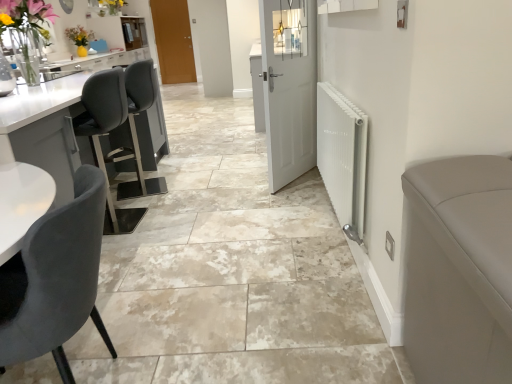
Describe the element at coordinates (58, 71) in the screenshot. I see `white glossy sink at upper left` at that location.

What do you see at coordinates (343, 157) in the screenshot? I see `white metallic radiator at right` at bounding box center [343, 157].

Find the location of a particular element. white matte door at center, the 1th door viewed from the front is located at coordinates (289, 87).

This screenshot has height=384, width=512. What do you see at coordinates (289, 87) in the screenshot?
I see `white matte door at center, marked as the 1th door in a right-to-left arrangement` at bounding box center [289, 87].

What do you see at coordinates (173, 41) in the screenshot? I see `brown wooden door at upper center, marked as the first door in a back-to-front arrangement` at bounding box center [173, 41].

Where is `white glossy sink at upper left`? This screenshot has width=512, height=384. white glossy sink at upper left is located at coordinates (58, 71).

From a real-world perspective, is white metallic radiator at right positioned under white matte door at center, marked as the 1th door in a right-to-left arrangement, based on gravity?

Yes, from a real-world perspective, white metallic radiator at right is under white matte door at center, marked as the 1th door in a right-to-left arrangement.

How distant is white metallic radiator at right from white matte door at center, which is the 2th door in back-to-front order?

The distance of white metallic radiator at right from white matte door at center, which is the 2th door in back-to-front order, is 30.82 inches.

Is white metallic radiator at right oriented away from white matte door at center, the 1th door from the bottom?

No, white matte door at center, the 1th door from the bottom, is not at the back of white metallic radiator at right.

In the scene shown: Is white metallic radiator at right next to white matte door at center, the 1th door viewed from the front, and touching it?

No, white metallic radiator at right is not in contact with white matte door at center, the 1th door viewed from the front.

You are a GUI agent. You are given a task and a screenshot of the screen. Output one action in this format:
    pyautogui.click(x=<x>, y=<y>)
    Task: Click on the door below the brown wooden door at upper center, which appears as the 2th door when ordered from the bottom (from the image's perspective)
    The height and width of the screenshot is (384, 512).
    Given the screenshot: What is the action you would take?
    pyautogui.click(x=289, y=87)

From the picture: Can you confirm if brown wooden door at upper center, marked as the first door in a back-to-front arrangement, is positioned to the left of white matte door at center, the 1th door from the bottom?

Correct, you'll find brown wooden door at upper center, marked as the first door in a back-to-front arrangement, to the left of white matte door at center, the 1th door from the bottom.

Looking at this image, considering the sizes of objects brown wooden door at upper center, which appears as the 2th door when ordered from the bottom, and white matte door at center, the 1th door from the bottom, in the image provided, who is taller, brown wooden door at upper center, which appears as the 2th door when ordered from the bottom, or white matte door at center, the 1th door from the bottom,?

With more height is brown wooden door at upper center, which appears as the 2th door when ordered from the bottom.

Is brown wooden door at upper center, arranged as the 2th door when viewed from the front, not inside white matte door at center, marked as the 1th door in a right-to-left arrangement?

Yes.

Based on the photo, which of these two, brown wooden door at upper center, which is the 1th door from top to bottom, or white glossy sink at upper left, is thinner?

Thinner between the two is brown wooden door at upper center, which is the 1th door from top to bottom.

Is brown wooden door at upper center, arranged as the 1th door when viewed from the left, taller than white glossy sink at upper left?

Yes, brown wooden door at upper center, arranged as the 1th door when viewed from the left, is taller than white glossy sink at upper left.

Considering the points (159, 59) and (61, 68), which point is behind, point (159, 59) or point (61, 68)?

The point (159, 59) is more distant.

Where is `sink on the left side of brown wooden door at upper center, which is the 1th door from top to bottom`? The height and width of the screenshot is (384, 512). sink on the left side of brown wooden door at upper center, which is the 1th door from top to bottom is located at coordinates (58, 71).

Between velvet grey chair at lower left and white glossy sink at upper left, which one appears on the left side from the viewer's perspective?

white glossy sink at upper left is more to the left.

Is there a large distance between velvet grey chair at lower left and white glossy sink at upper left?

Yes, velvet grey chair at lower left and white glossy sink at upper left are quite far apart.

Does velvet grey chair at lower left have a lesser height compared to white glossy sink at upper left?

No.

From the image's perspective, between velvet grey chair at lower left and white glossy sink at upper left, which one is located above?

white glossy sink at upper left, from the image's perspective.

From a real-world perspective, does white glossy sink at upper left sit lower than white metallic radiator at right?

Incorrect, from a real-world perspective, white glossy sink at upper left is higher than white metallic radiator at right.

At what (x,y) coordinates should I click in order to perform the action: click on radiator on the right side of white glossy sink at upper left. Please return your answer as a coordinate pair (x, y). The image size is (512, 384). Looking at the image, I should click on (343, 157).

Are white glossy sink at upper left and white metallic radiator at right located far from each other?

Yes.

From the picture: Does white glossy sink at upper left have a smaller size compared to white metallic radiator at right?

→ Correct, white glossy sink at upper left occupies less space than white metallic radiator at right.

Considering the relative positions of white matte door at center, marked as the 1th door in a right-to-left arrangement, and brown wooden door at upper center, which is the 1th door from top to bottom, in the image provided, is white matte door at center, marked as the 1th door in a right-to-left arrangement, in front of brown wooden door at upper center, which is the 1th door from top to bottom,?

That is True.

Is white matte door at center, which is the 2th door in back-to-front order, bigger or smaller than brown wooden door at upper center, positioned as the 2th door in right-to-left order?

white matte door at center, which is the 2th door in back-to-front order, is bigger than brown wooden door at upper center, positioned as the 2th door in right-to-left order.

Can you confirm if white matte door at center, marked as the 1th door in a right-to-left arrangement, is taller than brown wooden door at upper center, arranged as the 2th door when viewed from the front?

No.

Is brown wooden door at upper center, which appears as the 2th door when ordered from the bottom, touching velvet grey chair at lower left?

brown wooden door at upper center, which appears as the 2th door when ordered from the bottom, and velvet grey chair at lower left are not in contact.

Considering the positions of point (158, 3) and point (27, 329), is point (158, 3) closer or farther from the camera than point (27, 329)?

Point (158, 3).

Is brown wooden door at upper center, marked as the first door in a back-to-front arrangement, situated inside velvet grey chair at lower left or outside?

The correct answer is: outside.

Is the depth of brown wooden door at upper center, positioned as the 2th door in right-to-left order, less than that of velvet grey chair at lower left?

No, the depth of brown wooden door at upper center, positioned as the 2th door in right-to-left order, is greater than that of velvet grey chair at lower left.

At what (x,y) coordinates should I click in order to perform the action: click on the 1st door behind the white metallic radiator at right. Please return your answer as a coordinate pair (x, y). Image resolution: width=512 pixels, height=384 pixels. Looking at the image, I should click on 289,87.

Identify the location of door that is on the right side of brown wooden door at upper center, arranged as the 2th door when viewed from the front. (289, 87).

Considering their positions, is white glossy sink at upper left positioned further to velvet grey chair at lower left than white metallic radiator at right?

white glossy sink at upper left is further to velvet grey chair at lower left.

Based on their spatial positions, is white matte door at center, which is counted as the second door, starting from the top, or velvet grey chair at lower left further from white metallic radiator at right?

velvet grey chair at lower left is further to white metallic radiator at right.

Based on their spatial positions, is brown wooden door at upper center, arranged as the 1th door when viewed from the left, or white metallic radiator at right closer to white matte door at center, positioned as the second door in left-to-right order?

white metallic radiator at right is closer to white matte door at center, positioned as the second door in left-to-right order.

Looking at the image, which one is located closer to white metallic radiator at right, white glossy sink at upper left or velvet grey chair at lower left?

velvet grey chair at lower left.

When comparing their distances from white matte door at center, positioned as the second door in left-to-right order, does white metallic radiator at right or brown wooden door at upper center, arranged as the 1th door when viewed from the left, seem further?

brown wooden door at upper center, arranged as the 1th door when viewed from the left, lies further to white matte door at center, positioned as the second door in left-to-right order, than the other object.

Looking at the image, which one is located closer to white glossy sink at upper left, white matte door at center, which is counted as the second door, starting from the top, or velvet grey chair at lower left?

white matte door at center, which is counted as the second door, starting from the top, lies closer to white glossy sink at upper left than the other object.

Based on their spatial positions, is velvet grey chair at lower left or white matte door at center, which is the 2th door in back-to-front order, closer to white metallic radiator at right?

white matte door at center, which is the 2th door in back-to-front order, lies closer to white metallic radiator at right than the other object.

Considering their positions, is velvet grey chair at lower left positioned closer to white matte door at center, positioned as the second door in left-to-right order, than white metallic radiator at right?

white metallic radiator at right is positioned closer to the anchor white matte door at center, positioned as the second door in left-to-right order.

Locate an element on the screen. This screenshot has width=512, height=384. door located between velvet grey chair at lower left and white glossy sink at upper left in the depth direction is located at coordinates point(289,87).

Image resolution: width=512 pixels, height=384 pixels. I want to click on sink located between white matte door at center, which is the 2th door in back-to-front order, and brown wooden door at upper center, which is the 1th door from top to bottom, in the depth direction, so click(58, 71).

Locate an element on the screen. This screenshot has width=512, height=384. radiator located between velvet grey chair at lower left and white matte door at center, which is the 2th door in back-to-front order, in the depth direction is located at coordinates (343, 157).

Locate an element on the screen. The height and width of the screenshot is (384, 512). sink located between white metallic radiator at right and brown wooden door at upper center, marked as the first door in a back-to-front arrangement, in the depth direction is located at coordinates (58, 71).